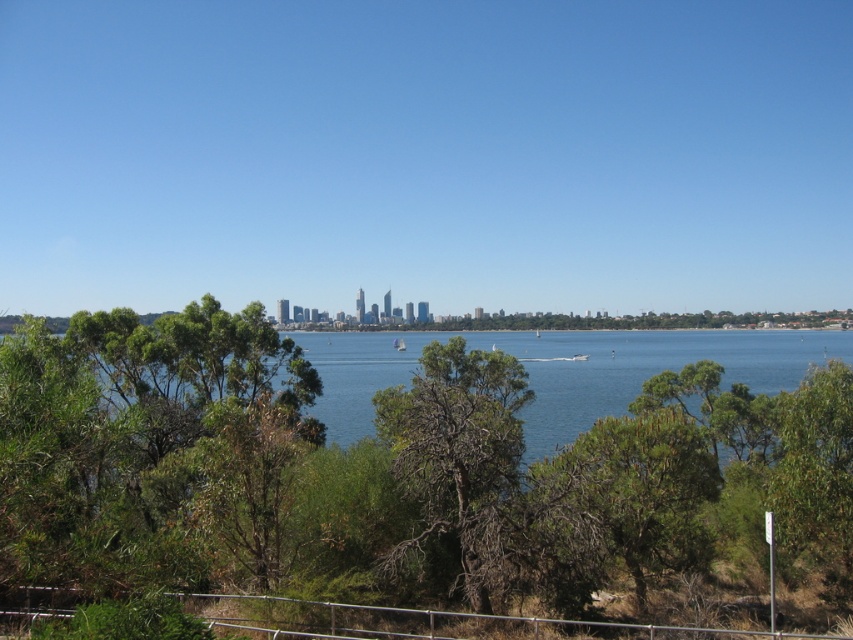
Does green textured tree at center come in front of brown/dry wood tree at center?

No, green textured tree at center is further to the viewer.

Where is `green textured tree at center`? This screenshot has width=853, height=640. green textured tree at center is located at coordinates (622, 502).

Between point (619, 436) and point (438, 445), which one is positioned in front?

Positioned in front is point (438, 445).

Locate an element on the screen. The width and height of the screenshot is (853, 640). green textured tree at center is located at coordinates (622, 502).

Does green leafy tree at center have a greater width compared to green textured tree at center?

Yes, green leafy tree at center is wider than green textured tree at center.

Is green leafy tree at center positioned at the back of green textured tree at center?

No, green leafy tree at center is closer to the viewer.

Does point (219, 483) come closer to viewer compared to point (592, 481)?

Yes, point (219, 483) is in front of point (592, 481).

You are a GUI agent. You are given a task and a screenshot of the screen. Output one action in this format:
    pyautogui.click(x=<x>, y=<y>)
    Task: Click on the green leafy tree at center
    Image resolution: width=853 pixels, height=640 pixels.
    Given the screenshot: What is the action you would take?
    pyautogui.click(x=396, y=481)

Is point (366, 428) positioned after point (502, 440)?

That is True.

Which of these two, blue water at center or brown/dry wood tree at center, stands taller?

With more height is blue water at center.

Who is more distant from viewer, (566, 378) or (439, 401)?

The point (566, 378) is behind.

At what (x,y) coordinates should I click in order to perform the action: click on blue water at center. Please return your answer as a coordinate pair (x, y). The width and height of the screenshot is (853, 640). Looking at the image, I should click on (645, 369).